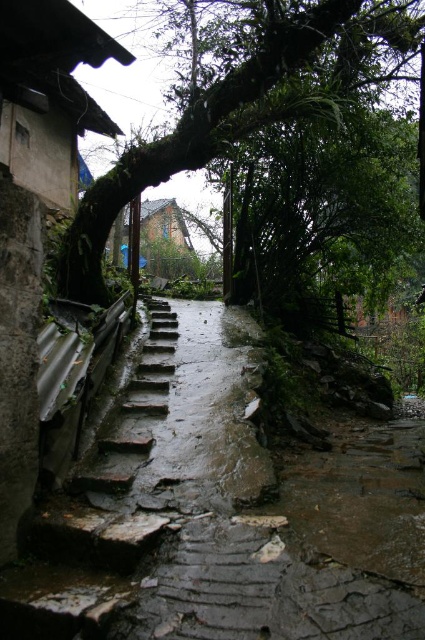
Question: Can you confirm if green mossy branch at upper center is positioned to the left of rusty stone stairs at left?

Choices:
 (A) no
 (B) yes

Answer: (A)

Question: Can you confirm if green mossy branch at upper center is wider than rusty stone stairs at left?

Choices:
 (A) yes
 (B) no

Answer: (A)

Question: Which point is closer to the camera taking this photo?

Choices:
 (A) (13, 577)
 (B) (337, 58)

Answer: (A)

Question: Does green mossy branch at upper center appear on the left side of rusty stone stairs at left?

Choices:
 (A) no
 (B) yes

Answer: (A)